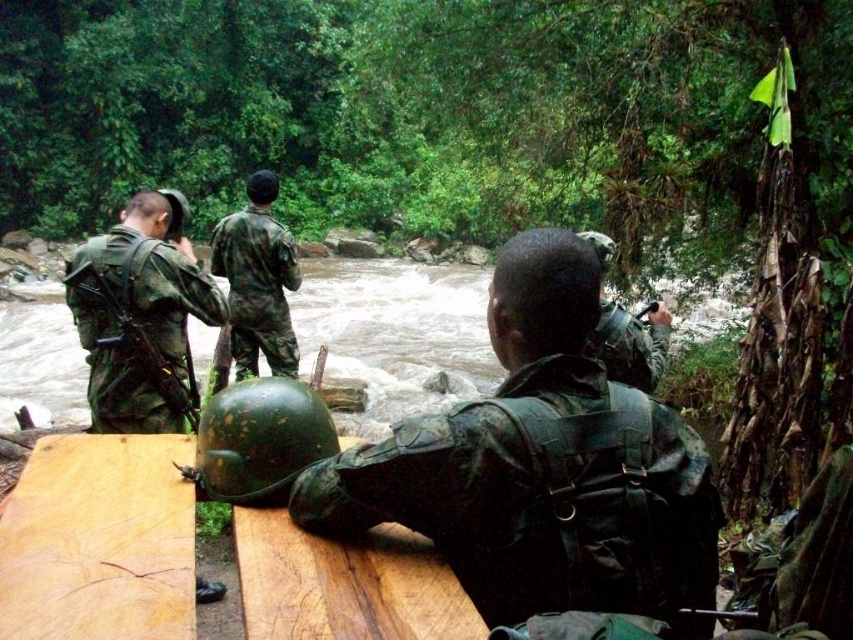
Is brown wood plank at lower left closer to the viewer compared to camouflage fabric helmet at left?

Yes.

Is the position of brown wood plank at lower left more distant than that of camouflage fabric helmet at left?

No, brown wood plank at lower left is in front of camouflage fabric helmet at left.

Image resolution: width=853 pixels, height=640 pixels. I want to click on brown wood plank at lower left, so click(99, 540).

How far apart are camouflage fabric helmet at left and green matte helmet at center?

camouflage fabric helmet at left and green matte helmet at center are 5.70 feet apart from each other.

Between camouflage fabric helmet at left and green matte helmet at center, which one has more height?

With more height is camouflage fabric helmet at left.

Is point (140, 300) farther from camera compared to point (308, 394)?

Yes, it is.

The image size is (853, 640). In order to click on camouflage fabric helmet at left in this screenshot , I will do `click(140, 316)`.

Which is more to the right, camouflage fabric helmet at center or wooden table at center?

camouflage fabric helmet at center is more to the right.

Between point (704, 525) and point (30, 500), which one is positioned behind?

The point (30, 500) is more distant.

Image resolution: width=853 pixels, height=640 pixels. Find the location of `camouflage fabric helmet at center`. camouflage fabric helmet at center is located at coordinates (540, 468).